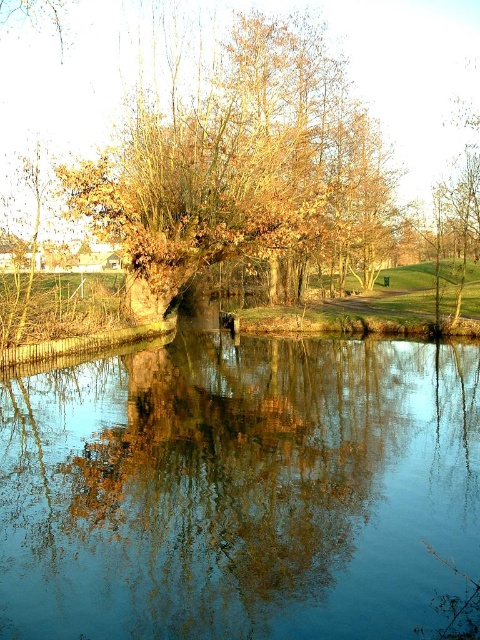
Question: Does blue reflective water at center have a larger size compared to brown leafy tree at center?

Choices:
 (A) no
 (B) yes

Answer: (A)

Question: Which point is farther from the camera taking this photo?

Choices:
 (A) (348, 579)
 (B) (250, 90)

Answer: (B)

Question: Does blue reflective water at center appear over brown leafy tree at center?

Choices:
 (A) no
 (B) yes

Answer: (A)

Question: Which of the following is the closest to the observer?

Choices:
 (A) blue reflective water at center
 (B) brown leafy tree at center

Answer: (A)

Question: Which object appears farthest from the camera in this image?

Choices:
 (A) brown leafy tree at center
 (B) blue reflective water at center

Answer: (A)

Question: Is blue reflective water at center wider than brown leafy tree at center?

Choices:
 (A) yes
 (B) no

Answer: (B)